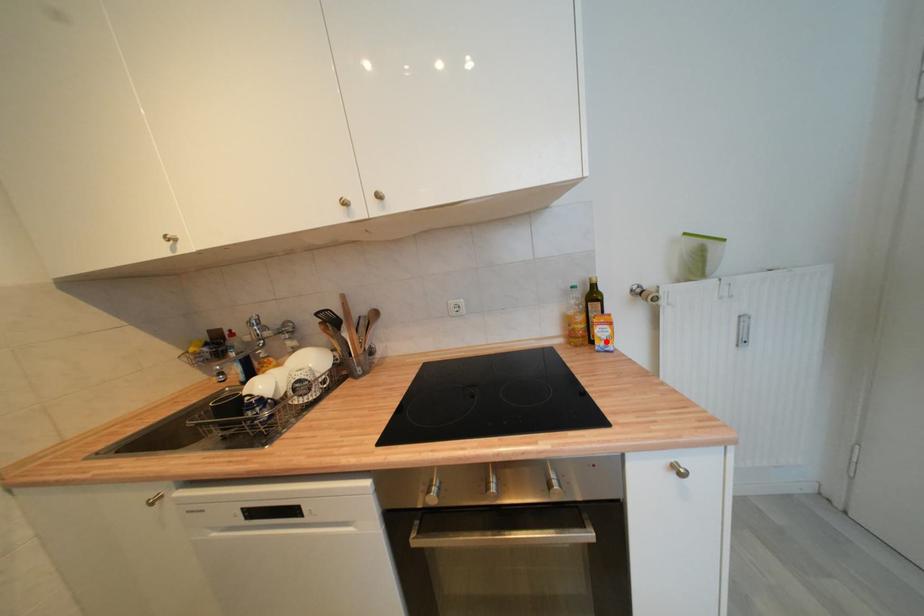
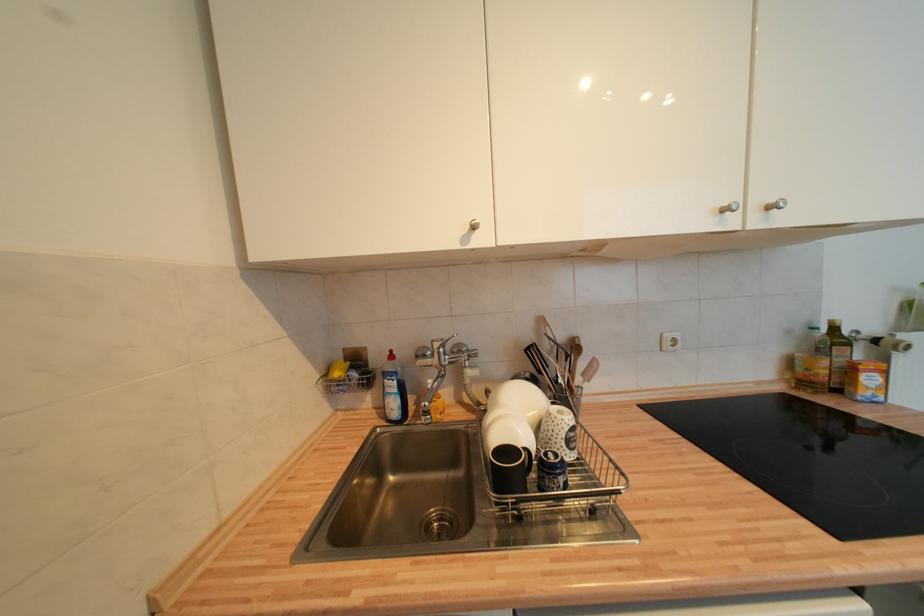
Question: A red point is marked in image1. In image2, is the corresponding 3D point closer to the camera or farther? Reply with the corresponding letter.

Choices:
 (A) The corresponding 3D point is closer.
 (B) The corresponding 3D point is farther.

Answer: (A)